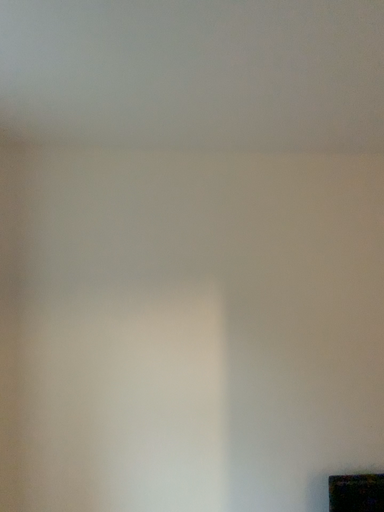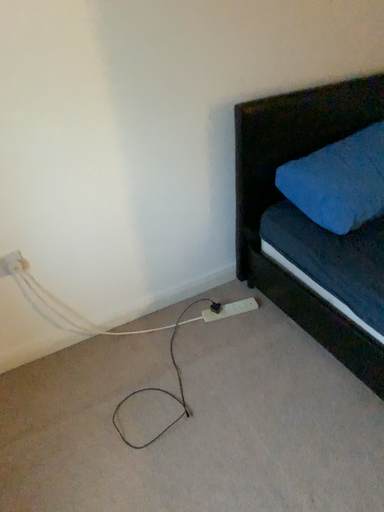
Question: Which way did the camera rotate in the video?

Choices:
 (A) rotated downward
 (B) rotated upward

Answer: (A)